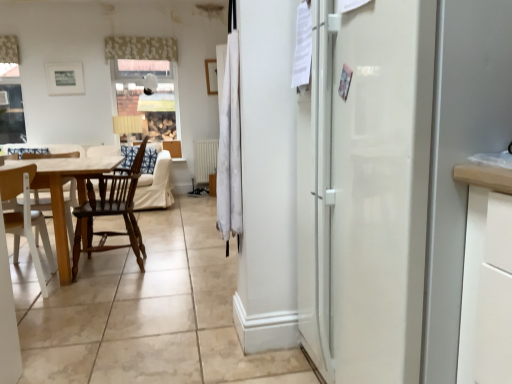
Question: Is the depth of white fabric curtain at center, the second curtain from the left, greater than that of dark brown wood chair at left, which ranks as the 2th chair in left-to-right order?

Choices:
 (A) no
 (B) yes

Answer: (A)

Question: Is white fabric curtain at center, positioned as the second curtain in back-to-front order, far from dark brown wood chair at left, arranged as the 1th chair when viewed from the right?

Choices:
 (A) yes
 (B) no

Answer: (A)

Question: Is white fabric curtain at center, the second curtain in the top-to-bottom sequence, looking in the opposite direction of dark brown wood chair at left, which ranks as the 2th chair in left-to-right order?

Choices:
 (A) no
 (B) yes

Answer: (A)

Question: Considering the relative positions of white fabric curtain at center, the second curtain from the left, and dark brown wood chair at left, arranged as the 1th chair when viewed from the right, in the image provided, is white fabric curtain at center, the second curtain from the left, to the right of dark brown wood chair at left, arranged as the 1th chair when viewed from the right, from the viewer's perspective?

Choices:
 (A) yes
 (B) no

Answer: (A)

Question: Is white fabric curtain at center, which is the 1th curtain from bottom to top, facing towards dark brown wood chair at left, which ranks as the 2th chair in left-to-right order?

Choices:
 (A) yes
 (B) no

Answer: (B)

Question: Is white wood chair at lower left, the second chair viewed from the right, situated inside dark brown wood chair at left, arranged as the 1th chair when viewed from the right, or outside?

Choices:
 (A) inside
 (B) outside

Answer: (B)

Question: From the image's perspective, is white wood chair at lower left, the second chair viewed from the right, above or below dark brown wood chair at left, arranged as the 1th chair when viewed from the right?

Choices:
 (A) above
 (B) below

Answer: (B)

Question: Is point (42, 230) positioned closer to the camera than point (122, 200)?

Choices:
 (A) closer
 (B) farther

Answer: (B)

Question: From a real-world perspective, relative to dark brown wood chair at left, arranged as the 1th chair when viewed from the right, is white wood chair at lower left, positioned as the 1th chair in left-to-right order, vertically above or below?

Choices:
 (A) above
 (B) below

Answer: (B)

Question: From the image's perspective, is white wood chair at lower left, the second chair viewed from the right, located above or below white fabric curtain at center, positioned as the second curtain in back-to-front order?

Choices:
 (A) below
 (B) above

Answer: (A)

Question: Considering their positions, is white wood chair at lower left, the second chair viewed from the right, located in front of or behind white fabric curtain at center, the second curtain in the top-to-bottom sequence?

Choices:
 (A) behind
 (B) front

Answer: (A)

Question: From a real-world perspective, is white wood chair at lower left, the second chair viewed from the right, physically located above or below white fabric curtain at center, arranged as the 1th curtain when viewed from the front?

Choices:
 (A) below
 (B) above

Answer: (A)

Question: Choose the correct answer: Is white wood chair at lower left, positioned as the 1th chair in left-to-right order, inside white fabric curtain at center, the second curtain in the top-to-bottom sequence, or outside it?

Choices:
 (A) outside
 (B) inside

Answer: (A)

Question: From a real-world perspective, is white wood chair at lower left, positioned as the 1th chair in left-to-right order, positioned above or below white floral fabric at upper center, the first curtain when ordered from back to front?

Choices:
 (A) above
 (B) below

Answer: (B)

Question: Is white wood chair at lower left, the second chair viewed from the right, taller or shorter than white floral fabric at upper center, acting as the second curtain starting from the front?

Choices:
 (A) tall
 (B) short

Answer: (A)